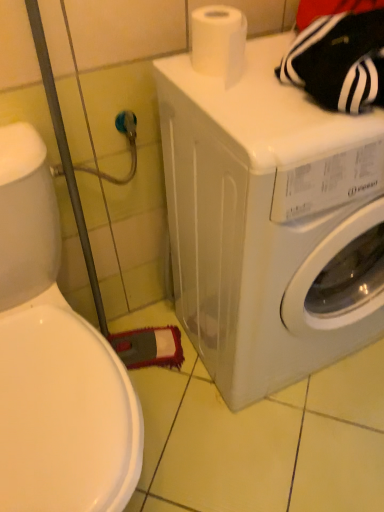
The image size is (384, 512). In order to click on vacant space to the left of white matte toilet paper at upper center in this screenshot , I will do [177, 74].